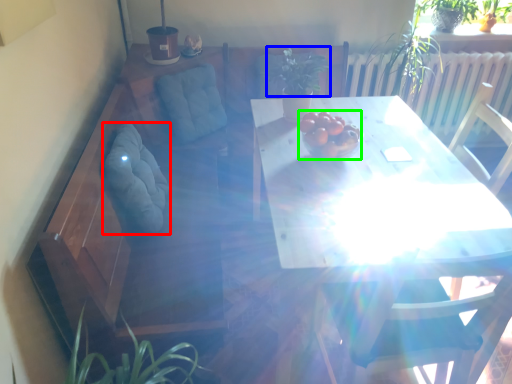
Question: Based on their relative distances, which object is farther from swivel chair (highlighted by a red box)? Choose from plant (highlighted by a blue box) and fruit (highlighted by a green box).

Choices:
 (A) plant
 (B) fruit

Answer: (A)